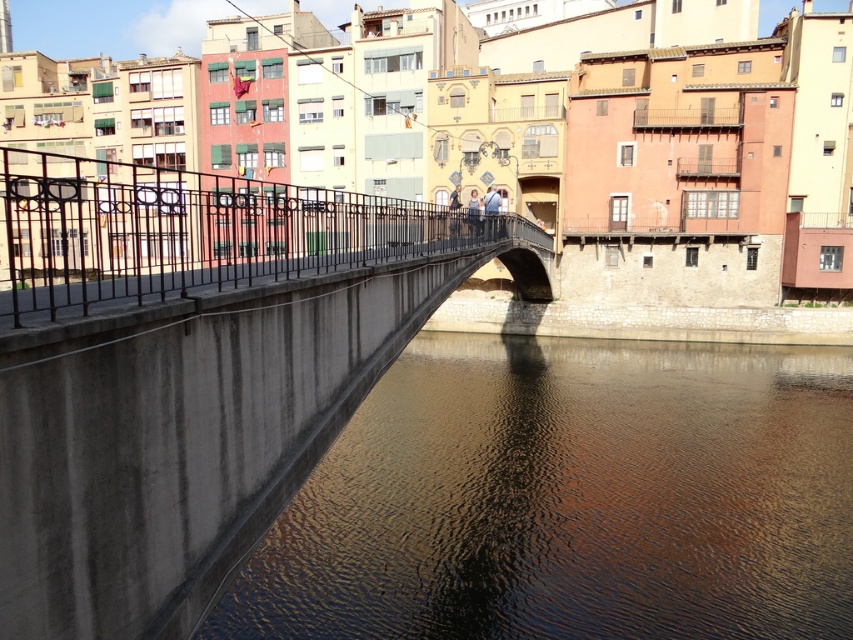
Can you confirm if brown concrete water at lower left is taller than matte blue jeans at center?

No, brown concrete water at lower left is not taller than matte blue jeans at center.

Is point (444, 474) behind point (494, 230)?

No, it is not.

Locate an element on the screen. Image resolution: width=853 pixels, height=640 pixels. brown concrete water at lower left is located at coordinates (570, 499).

Measure the distance from light brown leather jacket at center to matte blue shirt at center.

light brown leather jacket at center is 2.73 meters away from matte blue shirt at center.

Between light brown leather jacket at center and matte blue shirt at center, which one has less height?

With less height is light brown leather jacket at center.

Between point (473, 188) and point (456, 204), which one is positioned in front?

Point (456, 204) is in front.

Identify the location of light brown leather jacket at center. (473, 212).

Does concrete bridge at center have a greater width compared to black wrought iron railing at upper left?

No.

Can you confirm if concrete bridge at center is positioned above black wrought iron railing at upper left?

Actually, concrete bridge at center is below black wrought iron railing at upper left.

The image size is (853, 640). Identify the location of concrete bridge at center. (190, 369).